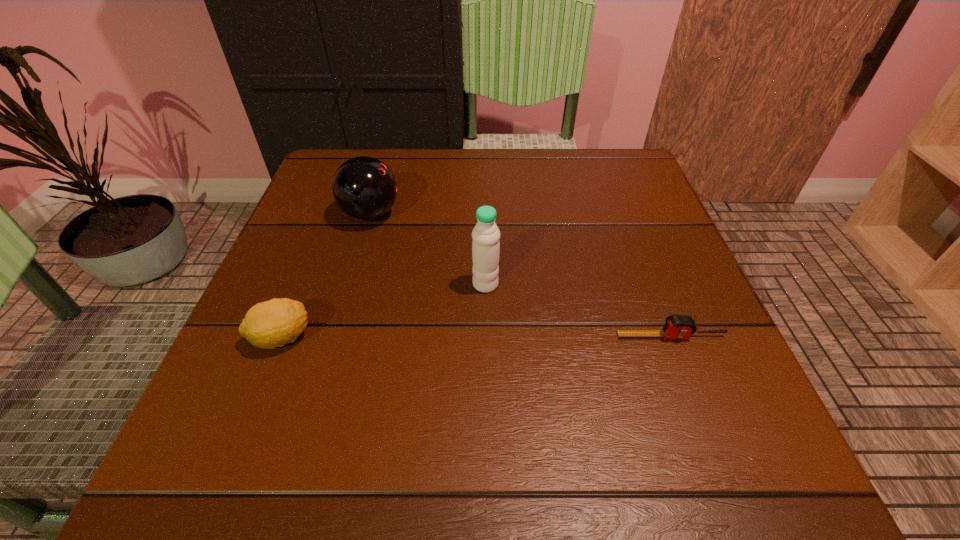
Identify the location of vacant region that satisfies the following two spatial constraints: 1. on the surface of the farthest object near the finger holes; 2. on the left side of the water bottle. Image resolution: width=960 pixels, height=540 pixels. [x=350, y=285].

Identify the location of free region that satisfies the following two spatial constraints: 1. on the surface of the farthest object near the finger holes; 2. on the back side of the rightmost object. Image resolution: width=960 pixels, height=540 pixels. (x=335, y=336).